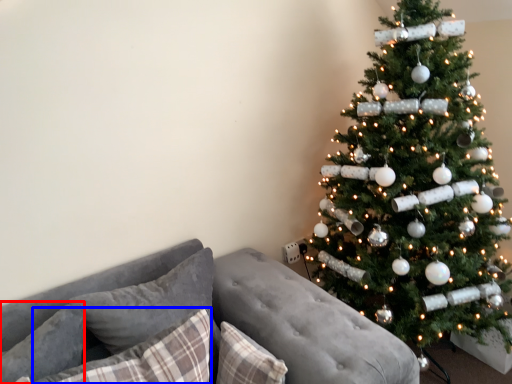
Question: Which of the following is the farthest to the observer, pillow (highlighted by a red box) or pillow (highlighted by a blue box)?

Choices:
 (A) pillow
 (B) pillow

Answer: (A)